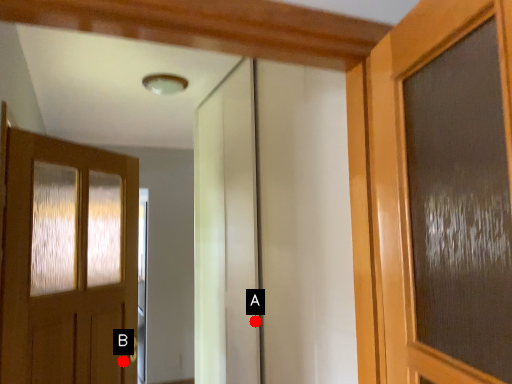
Question: Two points are circled on the image, labeled by A and B beside each circle. Which point appears farthest from the camera in this image?

Choices:
 (A) A is further
 (B) B is further

Answer: (B)